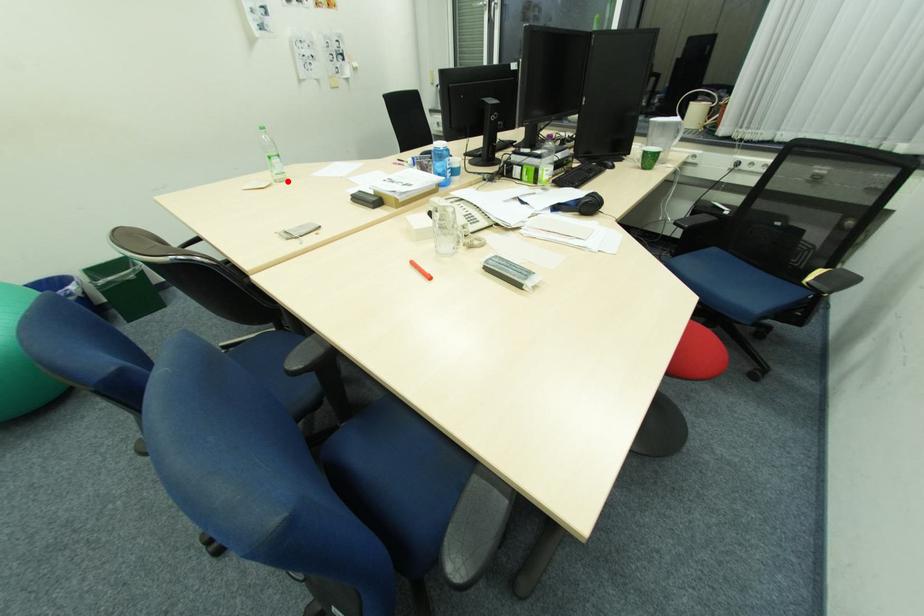
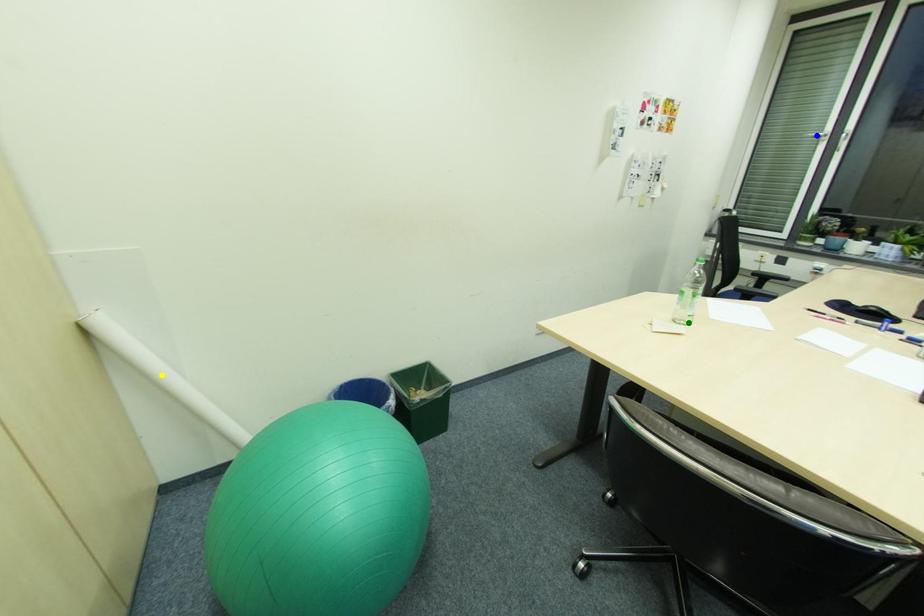
Question: I am providing you with two images of the same scene from different viewpoints. A red point is marked on the first image. You are given multiple points on the second image. Which point in image 2 represents the same 3d spot as the red point in image 1?

Choices:
 (A) blue point
 (B) yellow point
 (C) green point

Answer: (C)